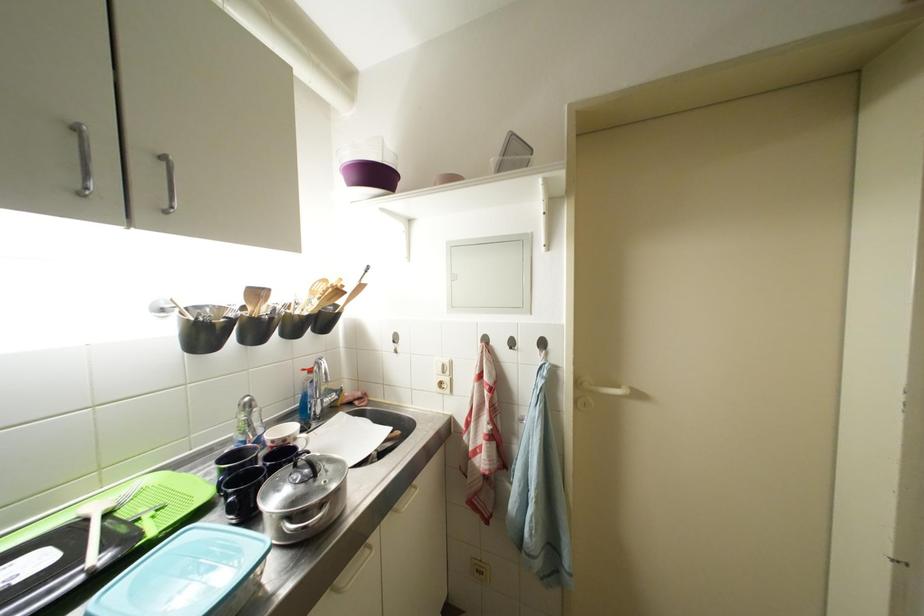
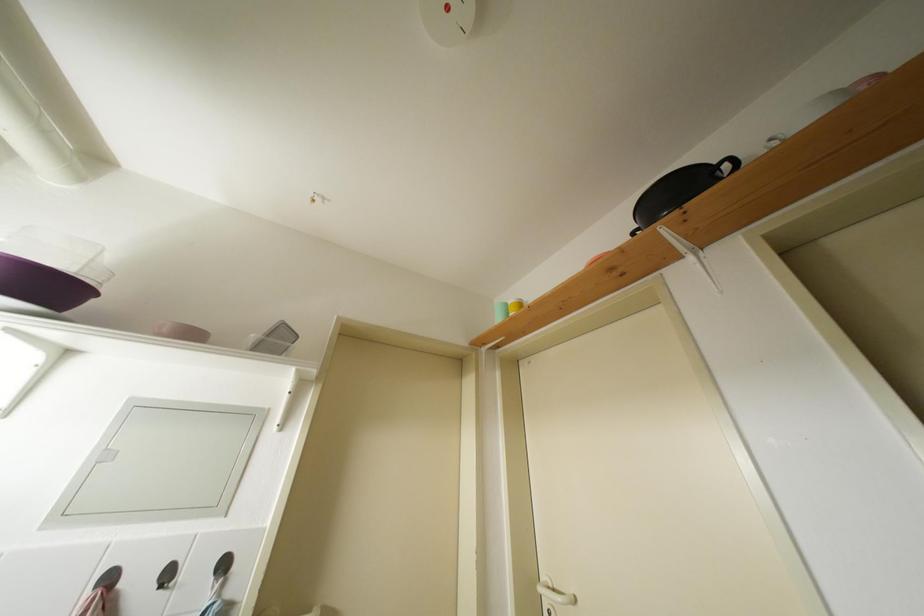
Based on the continuous images, in which direction is the camera rotating?

The camera rotated toward right-up.